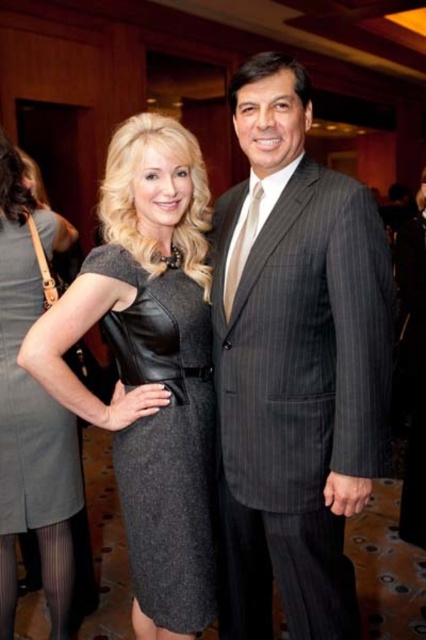
Question: Can you confirm if gray pinstripe suit at right is thinner than gray leather dress at center?

Choices:
 (A) no
 (B) yes

Answer: (A)

Question: Estimate the real-world distances between objects in this image. Which object is closer to the gray pinstripe suit at right?

Choices:
 (A) gray leather dress at center
 (B) black leather dress at center

Answer: (B)

Question: Considering the real-world distances, which object is closest to the gray pinstripe suit at right?

Choices:
 (A) gray leather dress at center
 (B) black leather dress at center

Answer: (B)

Question: Which object is the closest to the gray leather dress at center?

Choices:
 (A) gray pinstripe suit at right
 (B) black leather dress at center

Answer: (B)

Question: Is gray pinstripe suit at right closer to the viewer compared to black leather dress at center?

Choices:
 (A) no
 (B) yes

Answer: (B)

Question: Is gray pinstripe suit at right below black leather dress at center?

Choices:
 (A) no
 (B) yes

Answer: (A)